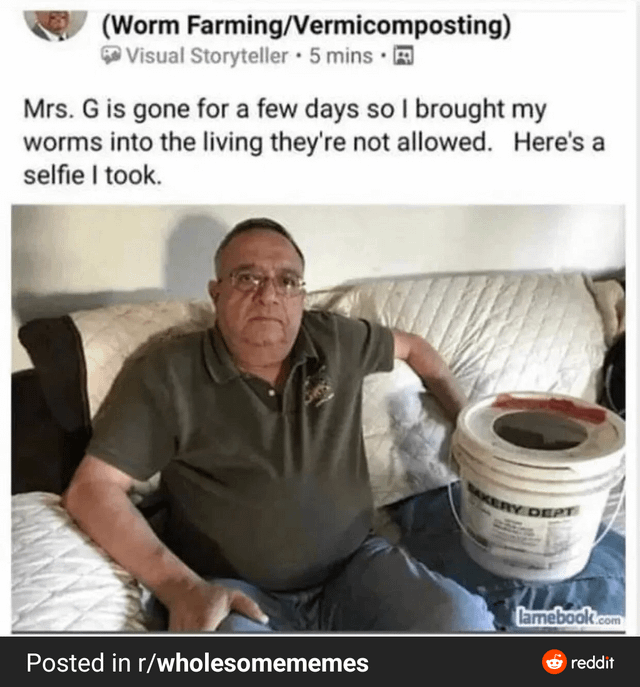
Find the location of `brown couch`. brown couch is located at coordinates (x=43, y=412).